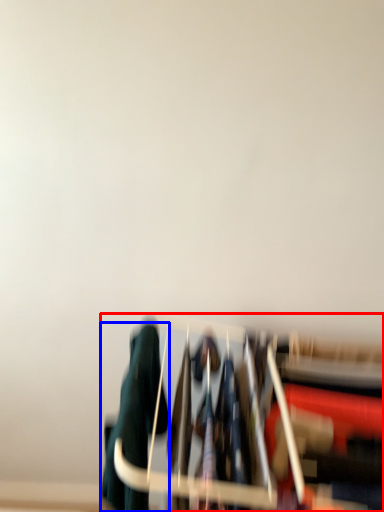
Question: Which of the following is the farthest to the observer, furniture (highlighted by a red box) or clothing (highlighted by a blue box)?

Choices:
 (A) furniture
 (B) clothing

Answer: (B)